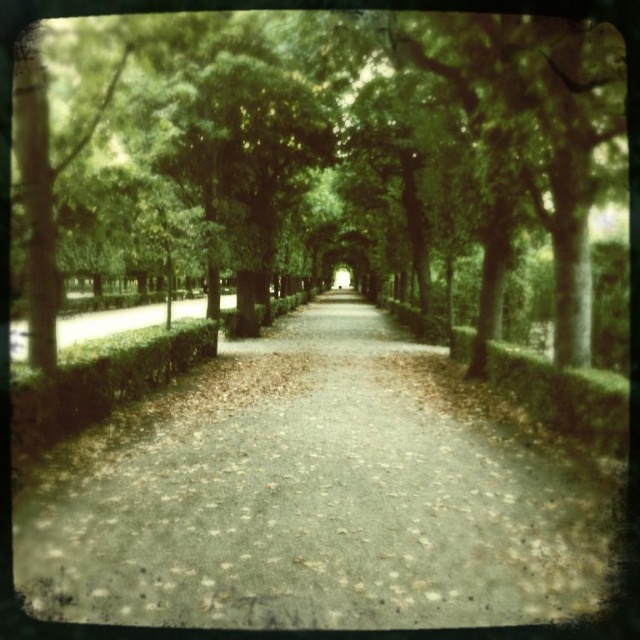
Which is behind, point (515, 100) or point (140, 534)?

The point (515, 100) is behind.

Which is above, green leafy tree at center or dull gray concrete path at center?

green leafy tree at center is higher up.

Which is in front, point (580, 29) or point (356, 372)?

Point (580, 29)

Locate an element on the screen. The image size is (640, 640). green leafy tree at center is located at coordinates (349, 148).